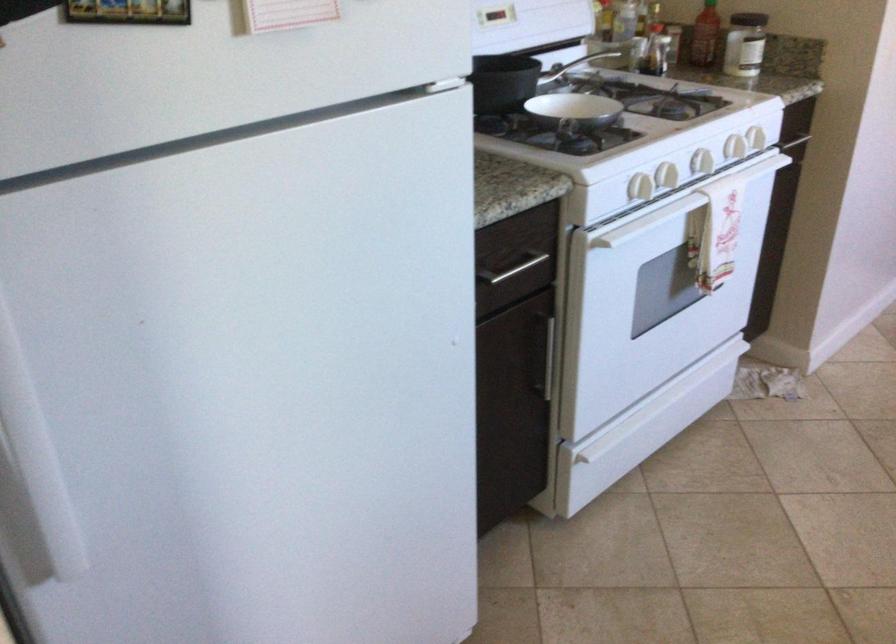
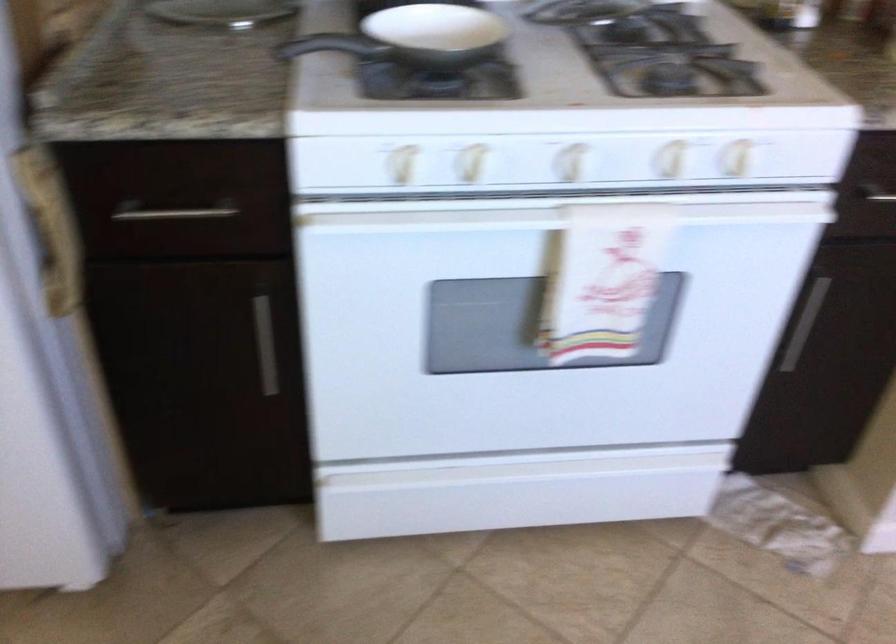
Locate, in the second image, the point that corresponds to point 513,247 in the first image.

(173, 213)